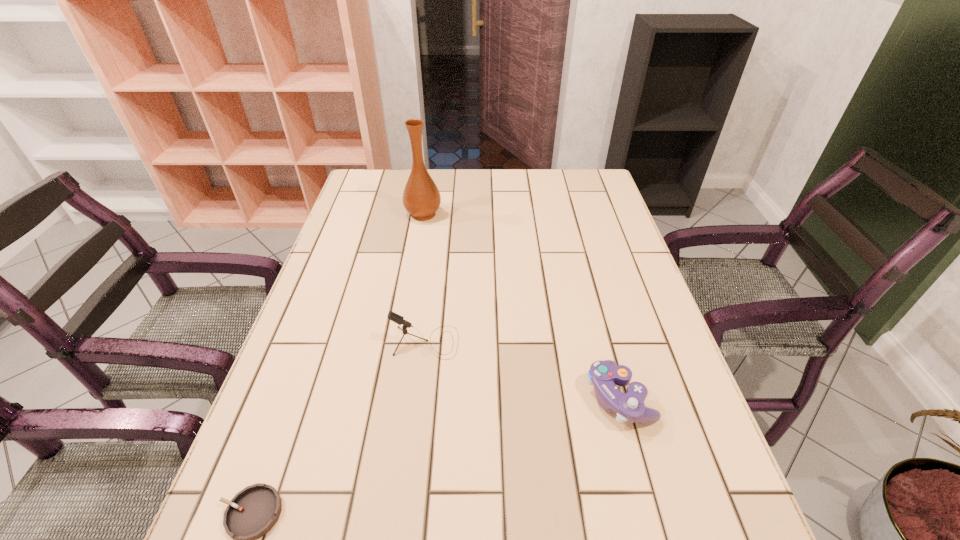
Where is `object that is at the right edge`? This screenshot has width=960, height=540. object that is at the right edge is located at coordinates (604, 375).

At what (x,y) coordinates should I click in order to perform the action: click on vacant space at the far edge. Please return your answer as a coordinate pair (x, y). The image size is (960, 540). Looking at the image, I should click on pos(497,179).

The width and height of the screenshot is (960, 540). Find the location of `vacant region at the left edge`. vacant region at the left edge is located at coordinates (341, 264).

What are the coordinates of `vacant space at the right edge` in the screenshot? It's located at (638, 484).

At what (x,y) coordinates should I click in order to perform the action: click on vacant space at the far left corner of the desktop. Please return your answer as a coordinate pair (x, y). Image resolution: width=960 pixels, height=540 pixels. Looking at the image, I should click on (361, 168).

Where is `vacant space at the far right corner of the desktop`? vacant space at the far right corner of the desktop is located at coordinates (584, 179).

Where is `free point between the tallest object and the rightmost object`? The width and height of the screenshot is (960, 540). free point between the tallest object and the rightmost object is located at coordinates (521, 306).

Find the location of `empty space that is in between the vase and the microphone`. empty space that is in between the vase and the microphone is located at coordinates (424, 278).

Locate an element on the screen. Image resolution: width=960 pixels, height=540 pixels. free space between the microphone and the tallest object is located at coordinates (424, 278).

Where is `free space between the second farthest object and the farthest object`? The width and height of the screenshot is (960, 540). free space between the second farthest object and the farthest object is located at coordinates pos(424,278).